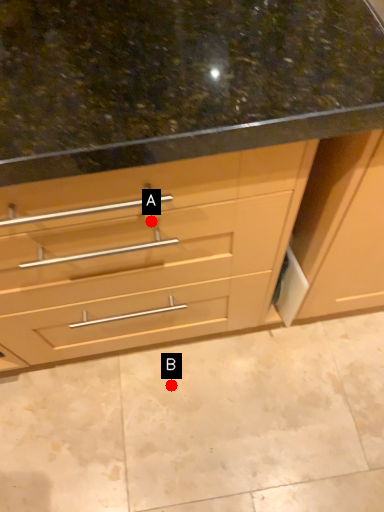
Question: Two points are circled on the image, labeled by A and B beside each circle. Among these points, which one is nearest to the camera?

Choices:
 (A) A is closer
 (B) B is closer

Answer: (A)